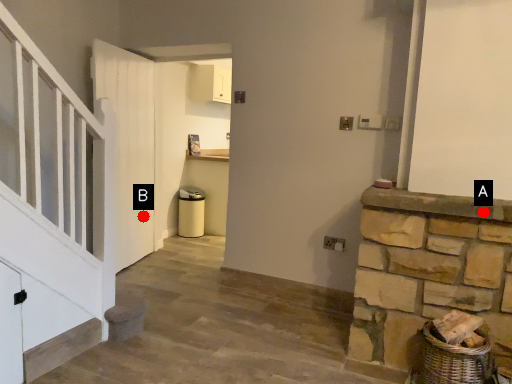
Question: Two points are circled on the image, labeled by A and B beside each circle. Which of the following is the closest to the observer?

Choices:
 (A) A is closer
 (B) B is closer

Answer: (A)